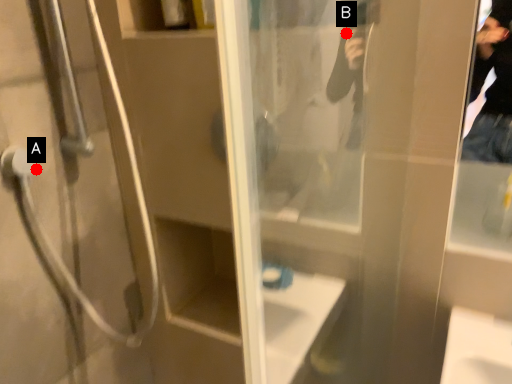
Question: Two points are circled on the image, labeled by A and B beside each circle. Which point is farther from the camera taking this photo?

Choices:
 (A) A is further
 (B) B is further

Answer: (A)